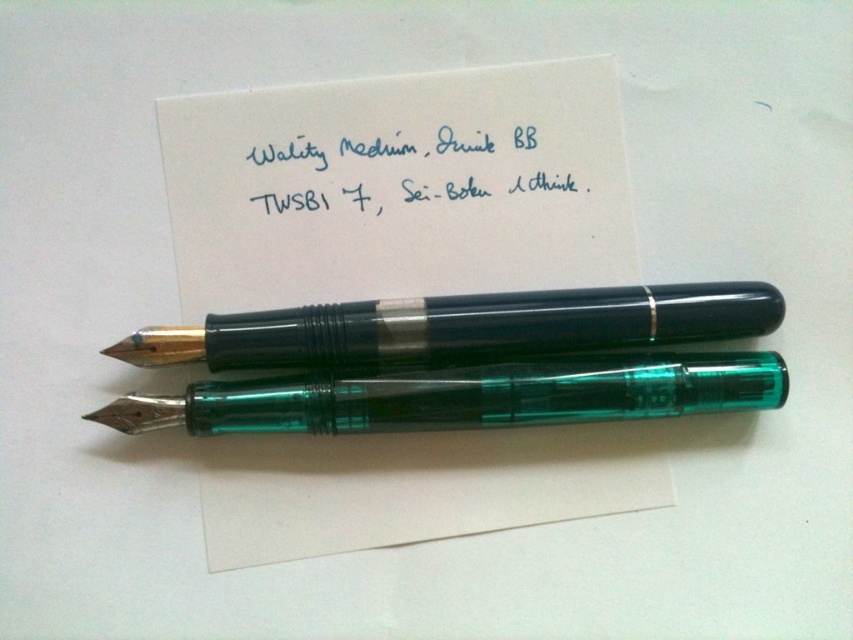
Does black translucent pen at center appear over blue ink writing at upper center?

Incorrect, black translucent pen at center is not positioned above blue ink writing at upper center.

Between black translucent pen at center and blue ink writing at upper center, which one has less height?

black translucent pen at center is shorter.

You are a GUI agent. You are given a task and a screenshot of the screen. Output one action in this format:
    pyautogui.click(x=<x>, y=<y>)
    Task: Click on the black translucent pen at center
    The width and height of the screenshot is (853, 640).
    Given the screenshot: What is the action you would take?
    [x=461, y=326]

The image size is (853, 640). I want to click on black translucent pen at center, so click(461, 326).

Is white paper at center taller than black translucent pen at center?

Indeed, white paper at center has a greater height compared to black translucent pen at center.

Who is positioned more to the right, white paper at center or black translucent pen at center?

Positioned to the right is black translucent pen at center.

Is point (238, 184) behind point (656, 294)?

Yes, it is.

Image resolution: width=853 pixels, height=640 pixels. In order to click on white paper at center in this screenshot , I will do `click(399, 186)`.

In the scene shown: Does transparent green pen at center appear under blue ink writing at upper center?

Yes, transparent green pen at center is below blue ink writing at upper center.

Measure the distance between transparent green pen at center and blue ink writing at upper center.

transparent green pen at center and blue ink writing at upper center are 10.96 inches apart.

Who is more distant from viewer, (637, 408) or (534, 145)?

Positioned behind is point (534, 145).

The height and width of the screenshot is (640, 853). In order to click on transparent green pen at center in this screenshot , I will do `click(465, 396)`.